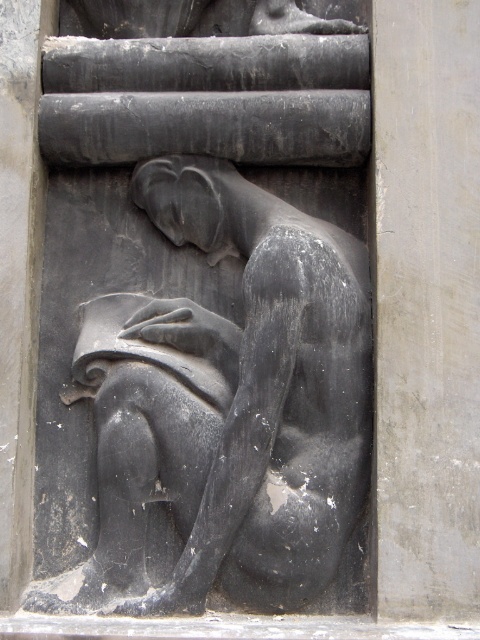
Question: Which point is closer to the camera?

Choices:
 (A) gray stone pillar at center
 (B) black stone sculpture at center

Answer: (A)

Question: Which point is closer to the camera?

Choices:
 (A) (463, 406)
 (B) (227, 324)

Answer: (A)

Question: Which of the following is the farthest from the observer?

Choices:
 (A) (376, 70)
 (B) (269, 536)

Answer: (A)

Question: Does black stone sculpture at center have a lesser width compared to gray stone pillar at center?

Choices:
 (A) yes
 (B) no

Answer: (B)

Question: Can you confirm if black stone sculpture at center is thinner than gray stone pillar at center?

Choices:
 (A) yes
 (B) no

Answer: (B)

Question: Is black stone sculpture at center bigger than gray stone pillar at center?

Choices:
 (A) yes
 (B) no

Answer: (A)